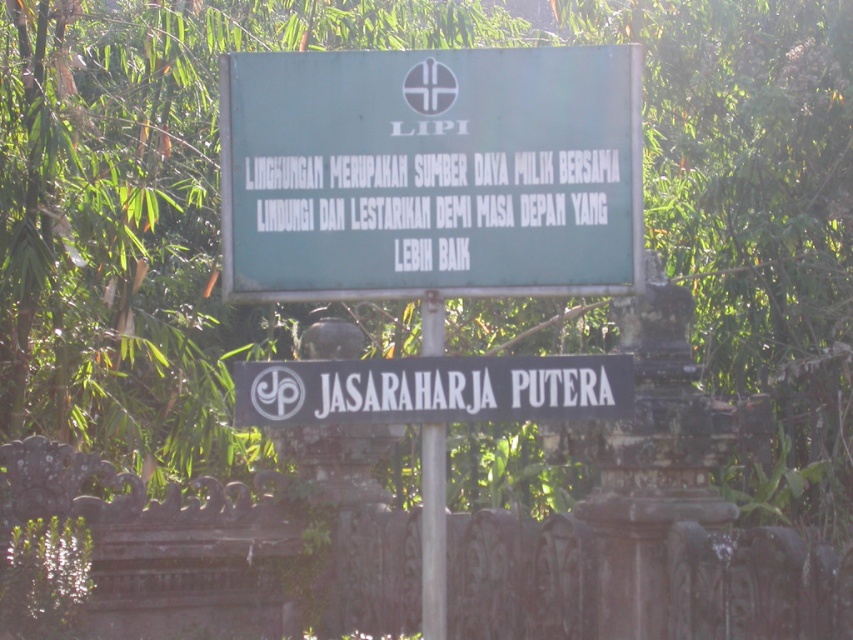
Who is positioned more to the left, black wood sign at center or metallic pole at center?

Positioned to the left is metallic pole at center.

Can you confirm if black wood sign at center is positioned to the left of metallic pole at center?

No, black wood sign at center is not to the left of metallic pole at center.

You are a GUI agent. You are given a task and a screenshot of the screen. Output one action in this format:
    pyautogui.click(x=<x>, y=<y>)
    Task: Click on the black wood sign at center
    The width and height of the screenshot is (853, 640).
    Given the screenshot: What is the action you would take?
    pyautogui.click(x=432, y=388)

Image resolution: width=853 pixels, height=640 pixels. I want to click on black wood sign at center, so click(x=432, y=388).

Can you confirm if green matte signboard at center is taller than black wood sign at center?

Yes, green matte signboard at center is taller than black wood sign at center.

Which of these two, green matte signboard at center or black wood sign at center, stands taller?

Standing taller between the two is green matte signboard at center.

Which is in front, point (431, 173) or point (583, 408)?

Point (583, 408) is more forward.

Find the location of a particular element. The image size is (853, 640). green matte signboard at center is located at coordinates (430, 172).

Is green matte signboard at center smaller than metallic pole at center?

No, green matte signboard at center is not smaller than metallic pole at center.

From the picture: Can you confirm if green matte signboard at center is bigger than metallic pole at center?

Yes, green matte signboard at center is bigger than metallic pole at center.

Describe the element at coordinates (430, 172) in the screenshot. I see `green matte signboard at center` at that location.

You are a GUI agent. You are given a task and a screenshot of the screen. Output one action in this format:
    pyautogui.click(x=<x>, y=<y>)
    Task: Click on the green matte signboard at center
    
    Given the screenshot: What is the action you would take?
    pyautogui.click(x=430, y=172)